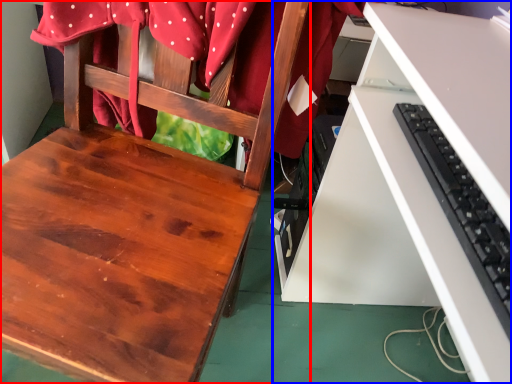
Question: Which of the following is the farthest to the observer, chair (highlighted by a red box) or desk (highlighted by a blue box)?

Choices:
 (A) chair
 (B) desk

Answer: (B)